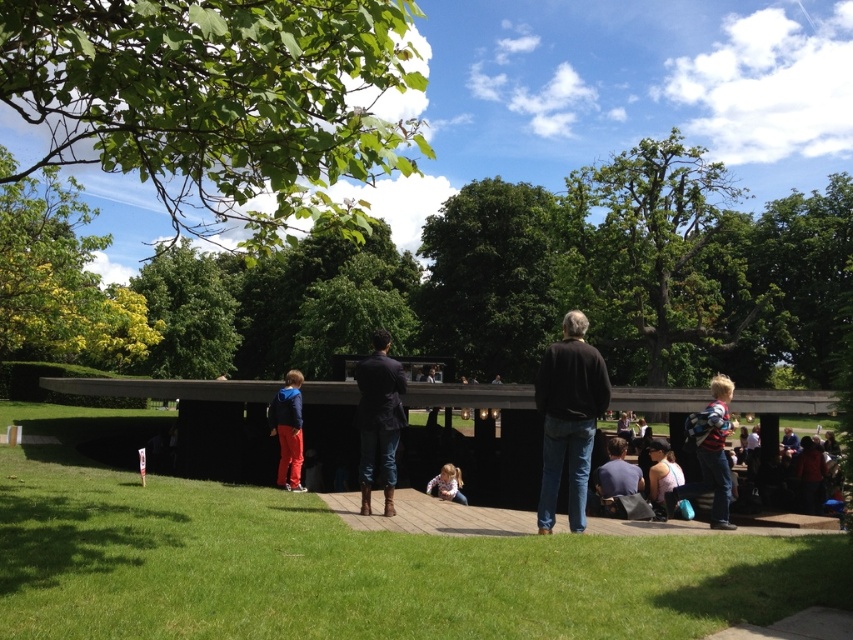
Question: Can you confirm if black matte jacket at center is smaller than striped shirt at right?

Choices:
 (A) yes
 (B) no

Answer: (A)

Question: Is dark brown leather boots at center positioned behind striped shirt at right?

Choices:
 (A) yes
 (B) no

Answer: (B)

Question: Which of the following is the farthest from the observer?

Choices:
 (A) (360, 492)
 (B) (270, 433)

Answer: (B)

Question: Which object appears closest to the camera in this image?

Choices:
 (A) light pink fabric at center
 (B) black matte jacket at center
 (C) dark brown leather boots at center

Answer: (B)

Question: Which of the following is the farthest from the observer?

Choices:
 (A) dark brown leather boots at center
 (B) dark blue shirt at center

Answer: (B)

Question: Does black matte jacket at center come behind light pink fabric at center?

Choices:
 (A) yes
 (B) no

Answer: (B)